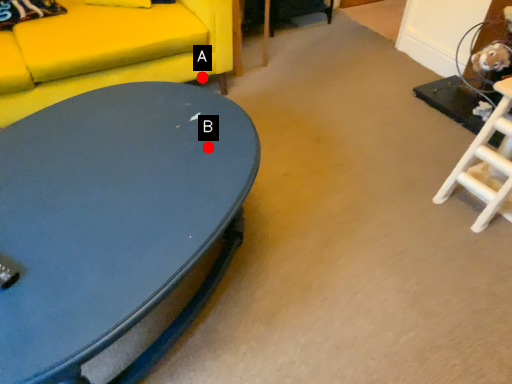
Question: Two points are circled on the image, labeled by A and B beside each circle. Which point is closer to the camera taking this photo?

Choices:
 (A) A is closer
 (B) B is closer

Answer: (B)